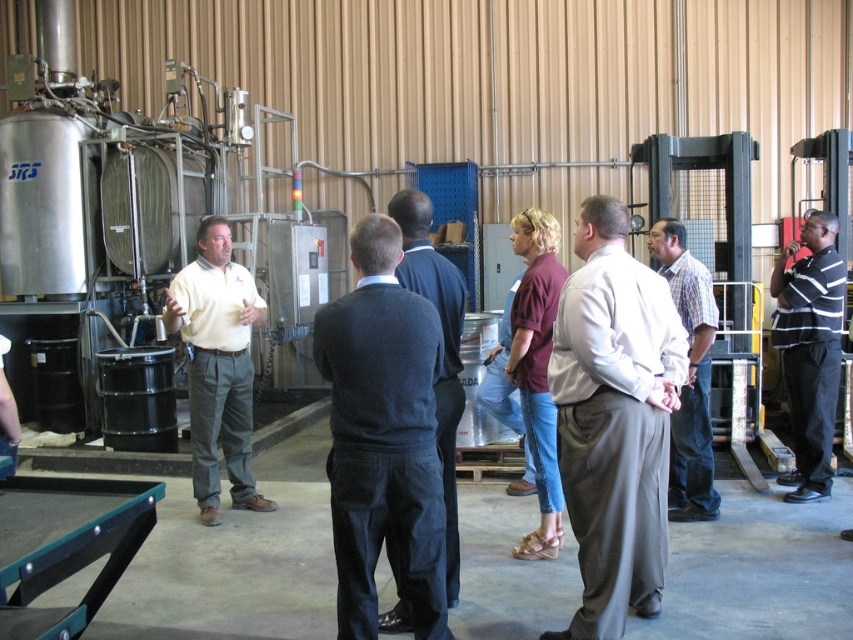
You are a photographer trying to capture a candid shot of the two people at the center of the group. You notice the dark gray sweater at center and the plaid cotton shirt at center. Which one is positioned to the left of the other?

The dark gray sweater at center is to the left of the plaid cotton shirt at center.

You are a photographer trying to capture a group photo of the two people in the middle wearing the dark gray sweater at center and plaid cotton shirt at center. Since you want to ensure both are clearly visible, which clothing item should you focus on to ensure the person is in focus first?

The dark gray sweater at center has a larger size compared to plaid cotton shirt at center, so focusing on the dark gray sweater at center first will ensure the person is in focus as it is bigger and easier to capture clearly.

You are part of the tour group and need to locate the person wearing the matte yellow shirt at center. Where would you find them relative to the person wearing the dark gray sweater at center?

The matte yellow shirt at center is above the dark gray sweater at center, so you would find the person wearing the matte yellow shirt at center positioned higher up compared to the person wearing the dark gray sweater at center.